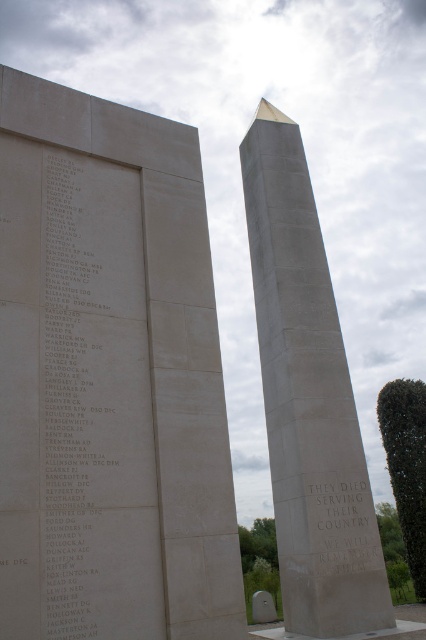
Is matte stone memorial at center to the left of white stone plaque at left from the viewer's perspective?

Incorrect, matte stone memorial at center is not on the left side of white stone plaque at left.

Between matte stone memorial at center and white stone plaque at left, which one appears on the right side from the viewer's perspective?

Positioned to the right is matte stone memorial at center.

Is point (206, 552) farther from viewer compared to point (60, 516)?

That is True.

The height and width of the screenshot is (640, 426). What are the coordinates of `matte stone memorial at center` in the screenshot? It's located at (109, 378).

Between white stone obelisk at center and white stone text at center, which one is positioned lower?

white stone text at center is lower down.

Consider the image. Which is more to the left, white stone obelisk at center or white stone text at center?

white stone obelisk at center

Does point (276, 436) come farther from viewer compared to point (376, 536)?

Yes.

You are a GUI agent. You are given a task and a screenshot of the screen. Output one action in this format:
    pyautogui.click(x=<x>, y=<y>)
    Task: Click on the white stone obelisk at center
    The height and width of the screenshot is (640, 426).
    Given the screenshot: What is the action you would take?
    pyautogui.click(x=307, y=400)

This screenshot has width=426, height=640. Describe the element at coordinates (69, 401) in the screenshot. I see `white stone plaque at left` at that location.

Which is behind, point (46, 516) or point (368, 524)?

Positioned behind is point (368, 524).

The height and width of the screenshot is (640, 426). What do you see at coordinates (69, 401) in the screenshot?
I see `white stone plaque at left` at bounding box center [69, 401].

Find the location of a particular element. white stone plaque at left is located at coordinates (69, 401).